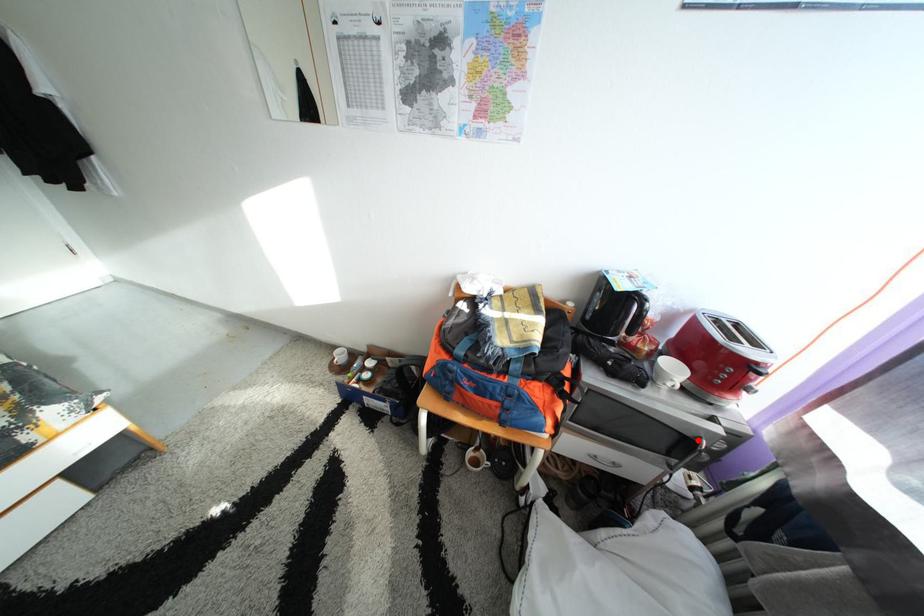
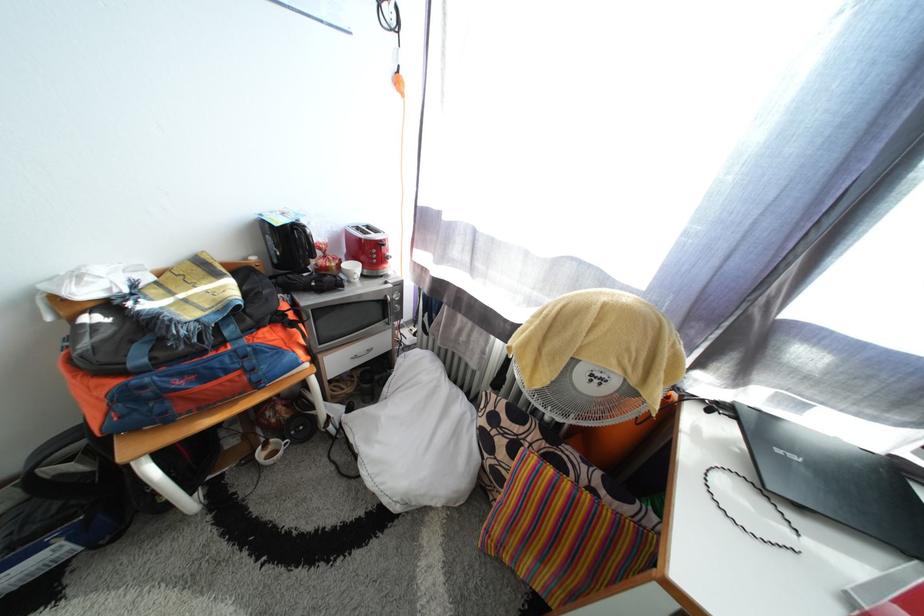
Where in the second image is the point corresponding to the highlighted location from the first image?

(390, 304)